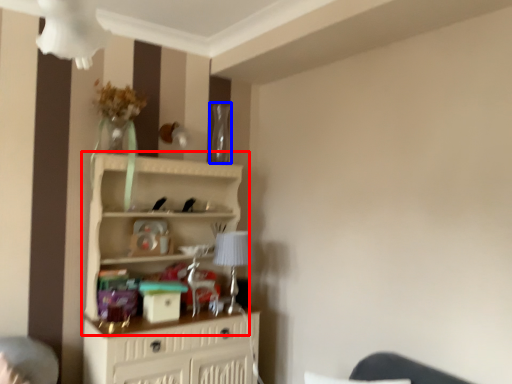
Question: Which of the following is the closest to the observer, shelf (highlighted by a red box) or glass vase (highlighted by a blue box)?

Choices:
 (A) shelf
 (B) glass vase

Answer: (A)